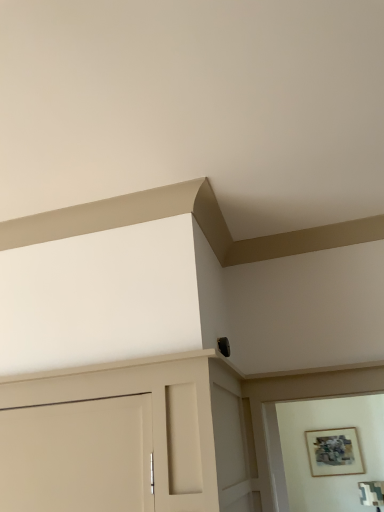
What is the approximate width of wooden textured picture frame at upper right?

wooden textured picture frame at upper right is 2.50 inches wide.

This screenshot has height=512, width=384. Describe the element at coordinates (334, 452) in the screenshot. I see `wooden textured picture frame at upper right` at that location.

Identify the location of wooden textured picture frame at upper right. Image resolution: width=384 pixels, height=512 pixels. click(334, 452).

This screenshot has width=384, height=512. I want to click on wooden textured picture frame at upper right, so click(x=334, y=452).